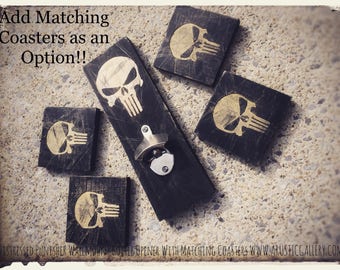
Locate an element on the screen. coasters is located at coordinates (35, 35).